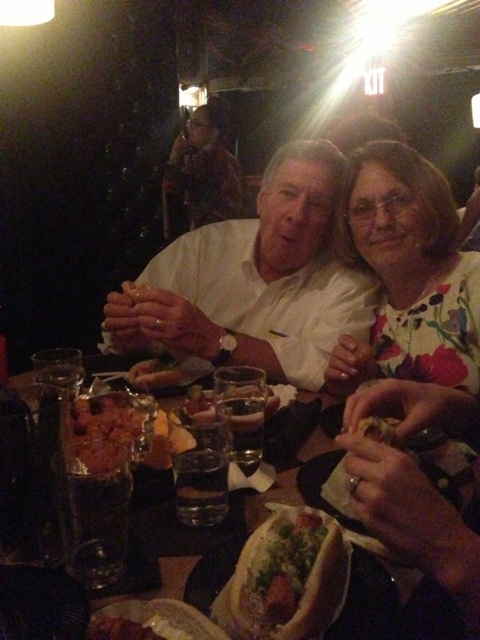
Question: Is white matte shirt at center wider than shiny brown bread at lower left?

Choices:
 (A) yes
 (B) no

Answer: (A)

Question: Which point is farther to the camera?

Choices:
 (A) slightly browned bread at center
 (B) clear glass at center
 (C) shiny brown bread at lower left

Answer: (A)

Question: Does white paper napkin at center have a smaller size compared to shiny metallic bowl at center?

Choices:
 (A) yes
 (B) no

Answer: (B)

Question: Which point is farther from the camera taking this photo?

Choices:
 (A) (307, 593)
 (B) (223, 460)

Answer: (B)

Question: Can you confirm if white paper napkin at center is positioned to the left of slightly translucent glass at center?

Choices:
 (A) yes
 (B) no

Answer: (B)

Question: Which of the following is the closest to the observer?

Choices:
 (A) (343, 337)
 (B) (76, 461)
 (C) (233, 419)
 (D) (220, 454)

Answer: (B)